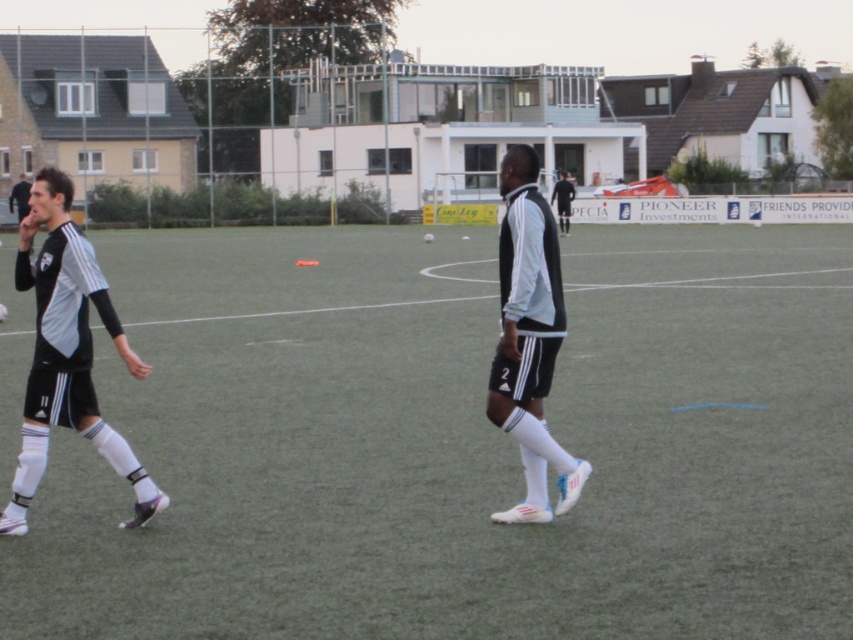
Question: Estimate the real-world distances between objects in this image. Which object is closer to the black jersey at left?

Choices:
 (A) green artificial turf at center
 (B) white adidas socks at center
 (C) black jersey at center

Answer: (A)

Question: Considering the real-world distances, which object is closest to the white adidas socks at center?

Choices:
 (A) black matte jersey at left
 (B) black jersey at left
 (C) black jersey at center
 (D) green artificial turf at center

Answer: (A)

Question: Is green artificial turf at center thinner than black matte jersey at left?

Choices:
 (A) no
 (B) yes

Answer: (A)

Question: Does green artificial turf at center come behind black matte jersey at left?

Choices:
 (A) yes
 (B) no

Answer: (B)

Question: Does white adidas socks at center have a larger size compared to black jersey at center?

Choices:
 (A) yes
 (B) no

Answer: (A)

Question: Which of the following is the farthest from the observer?

Choices:
 (A) (508, 362)
 (B) (16, 204)
 (C) (207, 444)

Answer: (B)